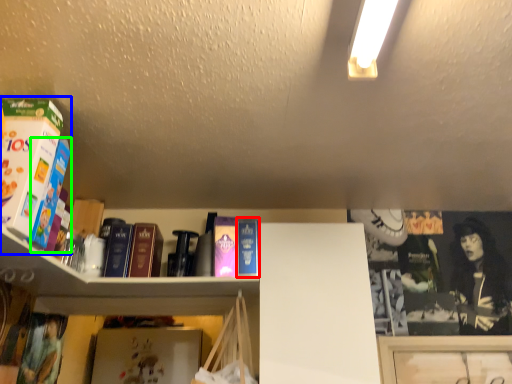
Question: Considering the real-world distances, which object is closest to paperback book (highlighted by a red box)? book (highlighted by a blue box) or book (highlighted by a green box).

Choices:
 (A) book
 (B) book

Answer: (B)